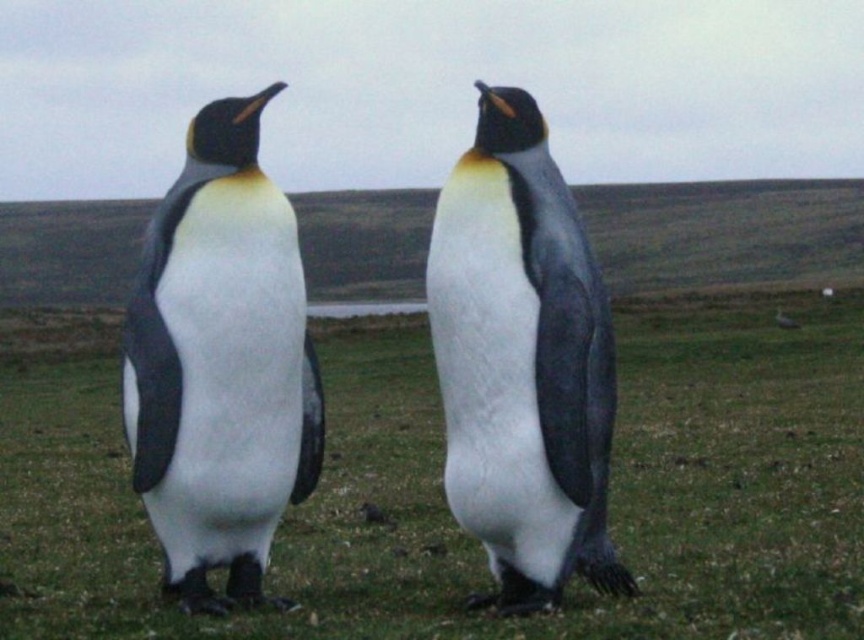
Question: Among these objects, which one is farthest from the camera?

Choices:
 (A) green grass at center
 (B) white matte penguin at left

Answer: (B)

Question: Can you confirm if green grass at center is positioned below matte black penguin at center?

Choices:
 (A) no
 (B) yes

Answer: (B)

Question: Is matte black penguin at center thinner than white matte penguin at left?

Choices:
 (A) no
 (B) yes

Answer: (A)

Question: Which of the following is the farthest from the observer?

Choices:
 (A) (148, 362)
 (B) (671, 563)
 (C) (474, 529)

Answer: (B)

Question: Is green grass at center above white matte penguin at left?

Choices:
 (A) no
 (B) yes

Answer: (A)

Question: Which point is farther to the camera?

Choices:
 (A) (195, 321)
 (B) (509, 333)

Answer: (A)